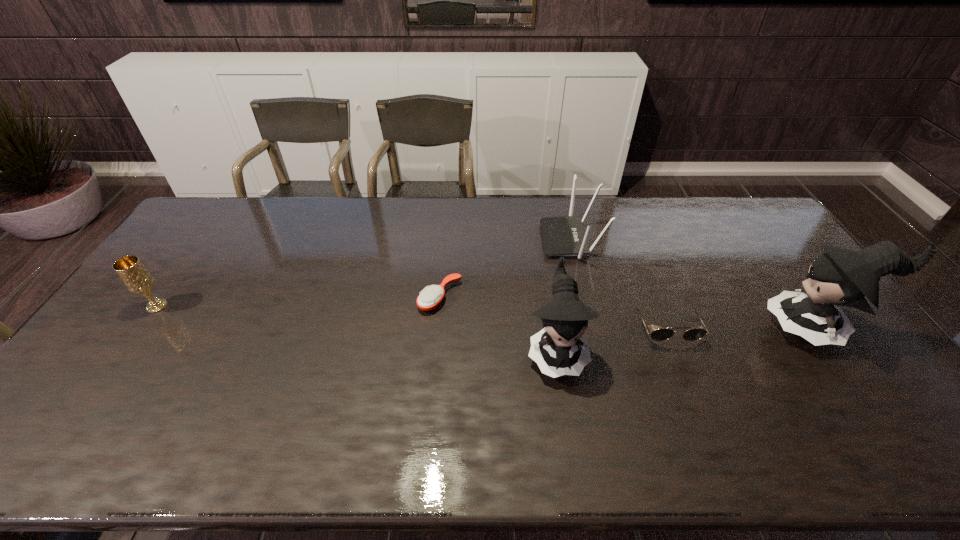
Find the location of a particular element. This screenshot has width=960, height=540. object that is at the far edge is located at coordinates (562, 236).

Locate an element on the screen. The image size is (960, 540). object that is at the near edge is located at coordinates pyautogui.click(x=556, y=349).

Locate an element on the screen. object at the left edge is located at coordinates (137, 279).

Locate an element on the screen. object located in the right edge section of the desktop is located at coordinates (840, 276).

The width and height of the screenshot is (960, 540). In the image, there is a desktop. What are the coordinates of `vacant space at the far edge` in the screenshot? It's located at (650, 222).

What are the coordinates of `blank area at the near edge` in the screenshot? It's located at (204, 397).

Image resolution: width=960 pixels, height=540 pixels. I want to click on free space at the left edge, so click(185, 238).

This screenshot has height=540, width=960. Find the location of `vacant space at the right edge of the desktop`. vacant space at the right edge of the desktop is located at coordinates (856, 336).

Image resolution: width=960 pixels, height=540 pixels. In the image, there is a desktop. Find the location of `vacant space at the far right corner`. vacant space at the far right corner is located at coordinates (733, 217).

Locate an element on the screen. The height and width of the screenshot is (540, 960). vacant region between the hairbrush and the leftmost object is located at coordinates (299, 301).